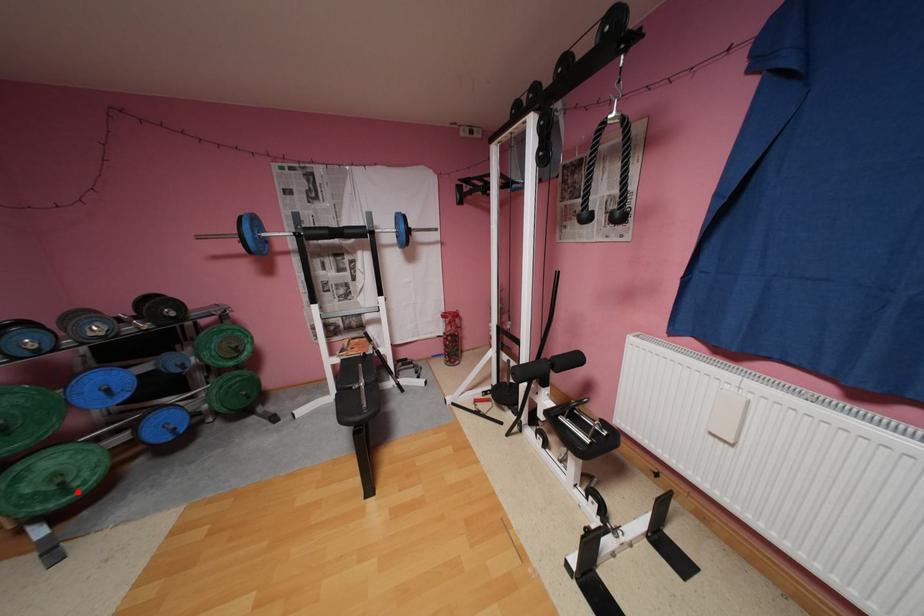
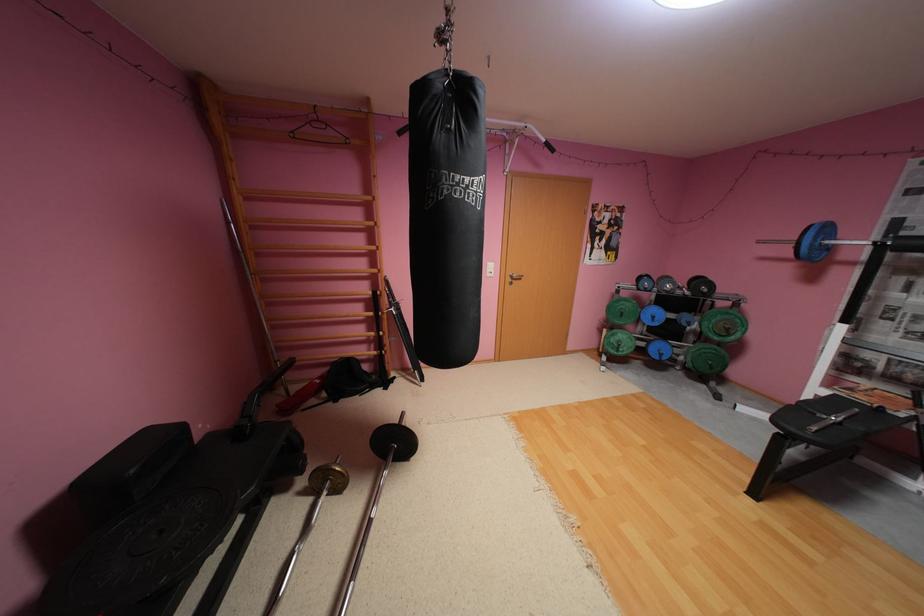
Question: I am providing you with two images of the same scene from different viewpoints. Given a red point in image1, look at the same physical point in image2. Is it:

Choices:
 (A) Closer to the viewpoint
 (B) Farther from the viewpoint

Answer: (B)